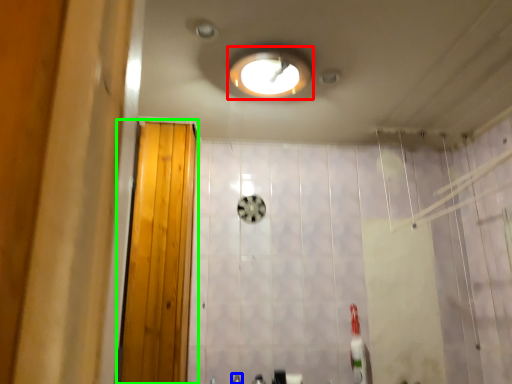
Question: Which object is the farthest from light fixture (highlighted by a red box)? Choose among these: faucet (highlighted by a blue box) or door (highlighted by a green box).

Choices:
 (A) faucet
 (B) door

Answer: (A)